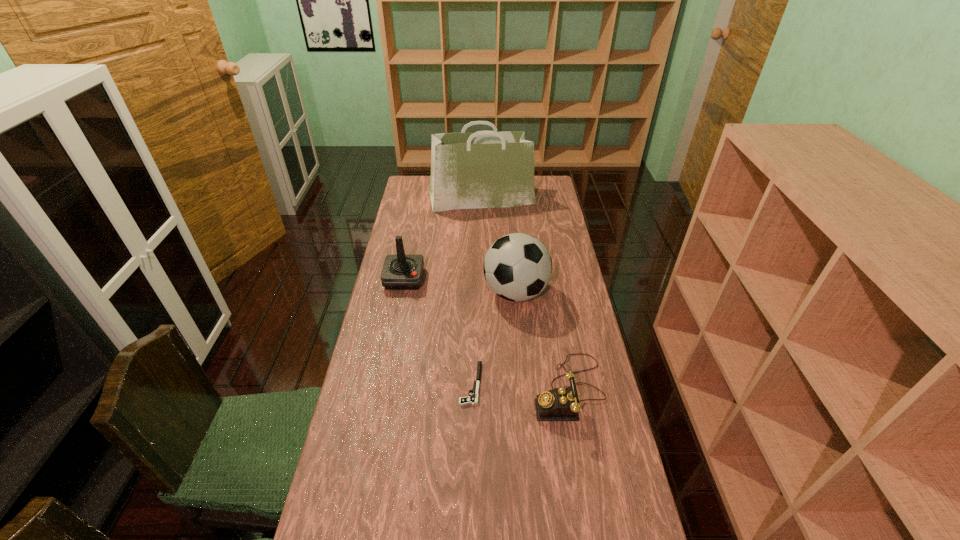
Identify the location of telephone present at the right edge. (560, 404).

Locate an element on the screen. object present at the far left corner is located at coordinates 487,169.

Where is `object that is at the far right corner`? This screenshot has height=540, width=960. object that is at the far right corner is located at coordinates (487, 169).

You are a GUI agent. You are given a task and a screenshot of the screen. Output one action in this format:
    pyautogui.click(x=<x>, y=<y>)
    Task: Click on the vacant area at the left edge of the desktop
    The height and width of the screenshot is (540, 960).
    Given the screenshot: What is the action you would take?
    click(386, 303)

In the image, there is a desktop. Where is `free space at the right edge`? The image size is (960, 540). free space at the right edge is located at coordinates (564, 358).

The height and width of the screenshot is (540, 960). I want to click on vacant space in between the fourth shortest object and the second shortest object, so click(x=542, y=341).

Identify the location of empty space that is in between the joystick and the shortest object. (438, 332).

Identify the location of unoccupied area between the second shortest object and the joystick. (487, 334).

The image size is (960, 540). I want to click on vacant space that's between the fourth shortest object and the third tallest object, so coord(460,286).

Find the location of `vacant area that lies between the telephone and the soccer ball`. vacant area that lies between the telephone and the soccer ball is located at coordinates (542, 341).